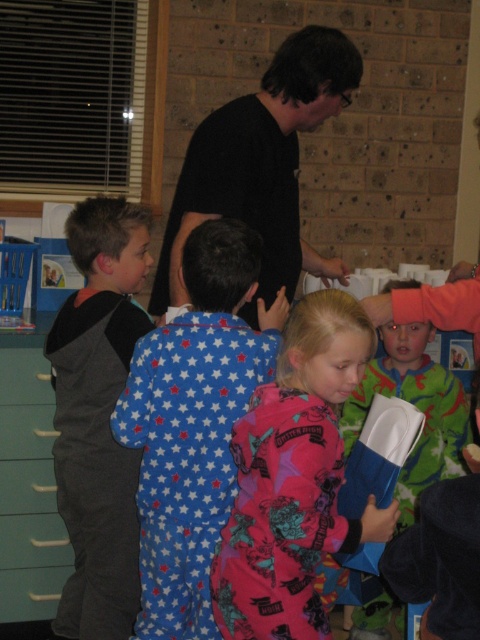
Question: Which of the following is the farthest from the observer?

Choices:
 (A) (326, 67)
 (B) (28, 499)
 (C) (43, 419)
 (D) (336, 496)

Answer: (B)

Question: Is teal plastic drawer at left wider than matte blue drawer at lower left?

Choices:
 (A) yes
 (B) no

Answer: (A)

Question: Which of these objects is positioned closest to the blue fabric book at center?

Choices:
 (A) dark gray fleece hoodie at left
 (B) black matte shirt at center
 (C) pink fleece pajamas at center
 (D) green matte drawer at left

Answer: (C)

Question: Which object is closer to the camera taking this photo?

Choices:
 (A) green matte drawer at lower left
 (B) teal plastic drawer at lower left
 (C) matte green drawer at lower left
 (D) black matte shirt at center

Answer: (D)

Question: Where is blue star-patterned pajamas at center-left located in relation to black matte shirt at center in the image?

Choices:
 (A) right
 (B) left

Answer: (B)

Question: Does blue star-patterned pajamas at center-left have a larger size compared to black matte shirt at center?

Choices:
 (A) yes
 (B) no

Answer: (B)